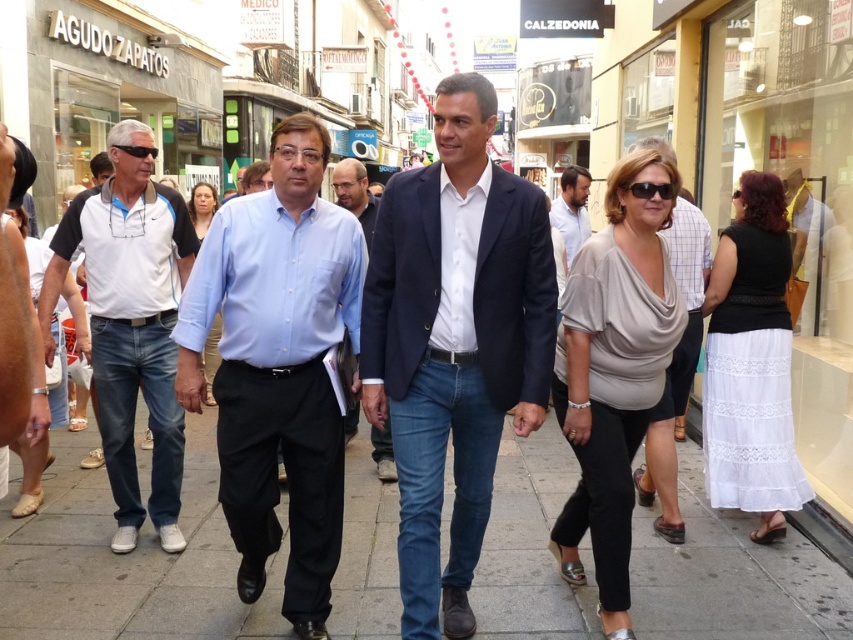
You are a fashion designer observing the urban street scene. You need to determine if the distance between the matte gray blouse at center and the white lace skirt at right is sufficient to allow a 1.5 meter social distancing requirement. Can you confirm if they meet the requirement?

The matte gray blouse at center and white lace skirt at right are 1.22 meters apart from each other, which is less than the required 1.5 meters for social distancing. Therefore, they do not meet the requirement.